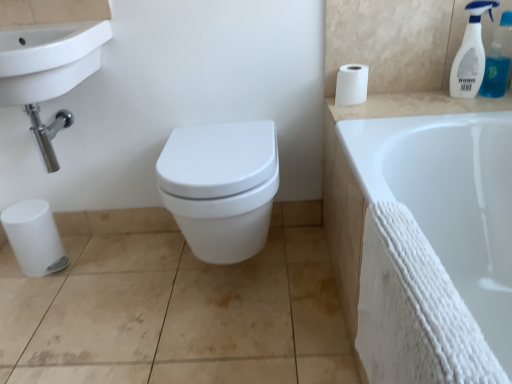
Question: Is white textured towel at lower right positioned before clear plastic spray bottle at upper right, acting as the 1th cleaning product starting from the right?

Choices:
 (A) no
 (B) yes

Answer: (B)

Question: Is clear plastic spray bottle at upper right, acting as the 1th cleaning product starting from the right, located within white textured towel at lower right?

Choices:
 (A) yes
 (B) no

Answer: (B)

Question: Considering the relative sizes of white textured towel at lower right and clear plastic spray bottle at upper right, acting as the 1th cleaning product starting from the right, in the image provided, is white textured towel at lower right shorter than clear plastic spray bottle at upper right, acting as the 1th cleaning product starting from the right,?

Choices:
 (A) no
 (B) yes

Answer: (A)

Question: From the image's perspective, is white textured towel at lower right below clear plastic spray bottle at upper right, acting as the 1th cleaning product starting from the right?

Choices:
 (A) yes
 (B) no

Answer: (A)

Question: Is white textured towel at lower right wider than clear plastic spray bottle at upper right, the second cleaning product in the left-to-right sequence?

Choices:
 (A) no
 (B) yes

Answer: (A)

Question: Is white matte toilet paper at upper right spatially inside white glossy bidet at center, or outside of it?

Choices:
 (A) outside
 (B) inside

Answer: (A)

Question: Considering their positions, is white matte toilet paper at upper right located in front of or behind white glossy bidet at center?

Choices:
 (A) front
 (B) behind

Answer: (B)

Question: From the image's perspective, relative to white glossy bidet at center, is white matte toilet paper at upper right above or below?

Choices:
 (A) below
 (B) above

Answer: (B)

Question: From a real-world perspective, is white matte toilet paper at upper right positioned above or below white glossy bidet at center?

Choices:
 (A) above
 (B) below

Answer: (A)

Question: Do you think clear plastic spray bottle at upper right, acting as the 1th cleaning product starting from the right, is within white textured towel at lower right, or outside of it?

Choices:
 (A) inside
 (B) outside

Answer: (B)

Question: In the image, is clear plastic spray bottle at upper right, acting as the 1th cleaning product starting from the right, on the left side or the right side of white textured towel at lower right?

Choices:
 (A) left
 (B) right

Answer: (B)

Question: From their relative heights in the image, would you say clear plastic spray bottle at upper right, acting as the 1th cleaning product starting from the right, is taller or shorter than white textured towel at lower right?

Choices:
 (A) short
 (B) tall

Answer: (A)

Question: Is point [x=505, y=72] positioned closer to the camera than point [x=493, y=243]?

Choices:
 (A) closer
 (B) farther

Answer: (B)

Question: Considering their positions, is white ceramic counter top at upper right located in front of or behind white matte toilet paper at upper right?

Choices:
 (A) behind
 (B) front

Answer: (B)

Question: Considering the positions of white ceramic counter top at upper right and white matte toilet paper at upper right in the image, is white ceramic counter top at upper right bigger or smaller than white matte toilet paper at upper right?

Choices:
 (A) big
 (B) small

Answer: (A)